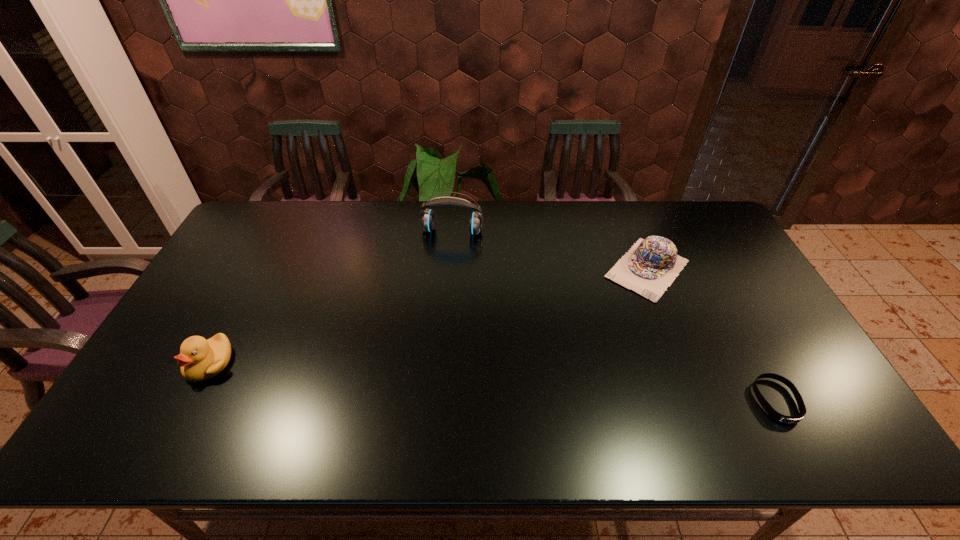
At what (x,y) coordinates should I click in order to perform the action: click on free space between the shortest object and the second shortest object. Please return your answer as a coordinate pair (x, y). Looking at the image, I should click on (711, 335).

Where is `free space between the leftmost object and the third object from right to left`? This screenshot has height=540, width=960. free space between the leftmost object and the third object from right to left is located at coordinates (331, 297).

Identify the location of vacant area that lies between the wristband and the tallest object. Image resolution: width=960 pixels, height=540 pixels. (614, 316).

At what (x,y) coordinates should I click in order to perform the action: click on vacant area between the leftmost object and the cap. Please return your answer as a coordinate pair (x, y). Image resolution: width=960 pixels, height=540 pixels. Looking at the image, I should click on (428, 316).

I want to click on blank region between the cap and the wristband, so click(711, 335).

At what (x,y) coordinates should I click in order to perform the action: click on vacant area between the leftmost object and the shortest object. Please return your answer as a coordinate pair (x, y). Looking at the image, I should click on (492, 382).

Identify the location of empty space between the third tallest object and the leftmost object. (428, 316).

Where is `vacant space that is in between the third object from right to left and the shortest object`? vacant space that is in between the third object from right to left and the shortest object is located at coordinates (614, 316).

Locate which object ranks second in proximity to the wristband. Please provide its 2D coordinates. Your answer should be formatted as a tuple, i.e. [(x, y)], where the tuple contains the x and y coordinates of a point satisfying the conditions above.

[(427, 219)]

The height and width of the screenshot is (540, 960). I want to click on object that is the second closest to the leftmost object, so click(651, 265).